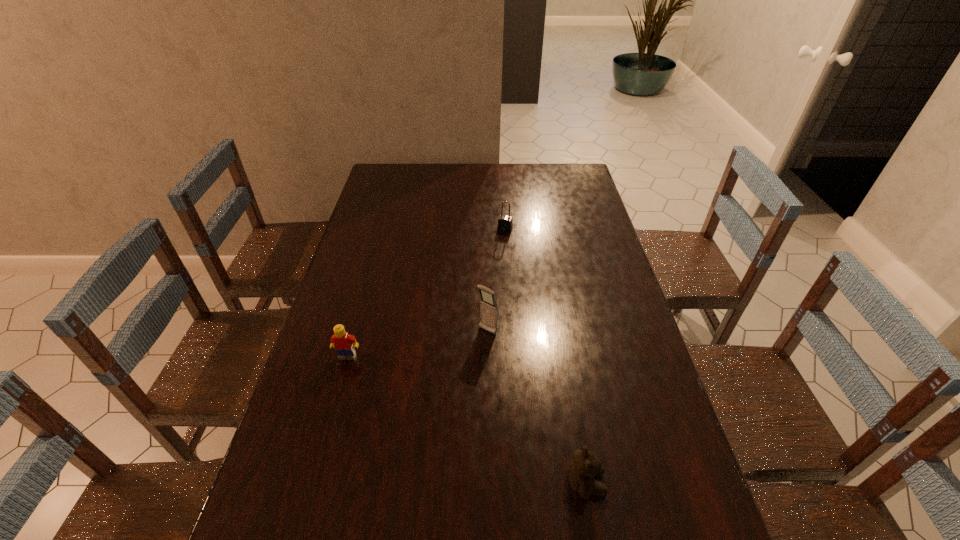
In the image, there is a desktop. At what (x,y) coordinates should I click in order to perform the action: click on vacant space at the right edge. Please return your answer as a coordinate pair (x, y). The image size is (960, 540). Looking at the image, I should click on (631, 405).

This screenshot has width=960, height=540. What are the coordinates of `vacant space at the far left corner of the desktop` in the screenshot? It's located at (412, 173).

Locate an element on the screen. Image resolution: width=960 pixels, height=540 pixels. free space at the near left corner is located at coordinates (292, 539).

You are a GUI agent. You are given a task and a screenshot of the screen. Output one action in this format:
    pyautogui.click(x=<x>, y=<y>)
    Task: Click on the vacant area at the far right corner
    
    Given the screenshot: What is the action you would take?
    pyautogui.click(x=578, y=173)

Find the location of a particular element. This screenshot has width=960, height=540. free space between the teddy bear and the second object from left to right is located at coordinates (537, 407).

At what (x,y) coordinates should I click in order to perform the action: click on free space between the leftmost object and the rightmost object. Please return your answer as a coordinate pair (x, y). The width and height of the screenshot is (960, 540). Looking at the image, I should click on (467, 420).

Find the location of a particular element. This screenshot has height=540, width=960. vacant area that lies between the third farthest object and the teddy bear is located at coordinates (467, 420).

This screenshot has height=540, width=960. In order to click on vacant region between the second object from right to left and the second object from left to right in this screenshot , I will do `click(496, 280)`.

The height and width of the screenshot is (540, 960). I want to click on free area in between the nearest object and the third object from left to right, so click(545, 356).

The width and height of the screenshot is (960, 540). I want to click on free spot between the tallest object and the third object from left to right, so click(496, 280).